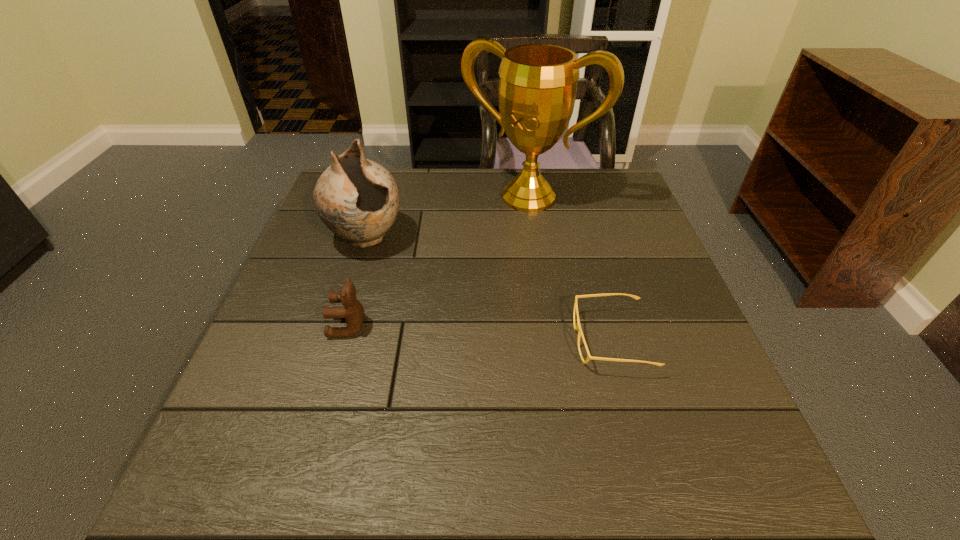
You are a GUI agent. You are given a task and a screenshot of the screen. Output one action in this format:
    pyautogui.click(x=<x>, y=<y>)
    Task: Click on the unoccupied position between the teddy bear and the shortest object
    
    Given the screenshot: What is the action you would take?
    pyautogui.click(x=480, y=333)

Identify the location of vacant space in between the second shortest object and the tallest object. (439, 261).

Locate an element on the screen. The height and width of the screenshot is (540, 960). vacant area that lies between the second shortest object and the shortest object is located at coordinates (480, 333).

In order to click on free space between the shortest object and the pottery in this screenshot , I will do `click(489, 289)`.

This screenshot has width=960, height=540. What are the coordinates of `vacant area that lies between the second tallest object and the tallest object` in the screenshot? It's located at (447, 217).

The image size is (960, 540). Identify the location of unoccupied position between the tallest object and the shortest object. (569, 268).

Where is `the third closest object to the shortest object`? The height and width of the screenshot is (540, 960). the third closest object to the shortest object is located at coordinates (353, 312).

The image size is (960, 540). Identify the location of object identified as the third closest to the pottery. (578, 327).

This screenshot has height=540, width=960. Find the location of `free space that satisfies the following two spatial constraints: 1. on the front side of the shortest object; 2. in front of the lenses of the award`. free space that satisfies the following two spatial constraints: 1. on the front side of the shortest object; 2. in front of the lenses of the award is located at coordinates (549, 340).

This screenshot has width=960, height=540. What are the coordinates of `vacant space that satisfies the following two spatial constraints: 1. on the front side of the teddy bear; 2. on the face of the second tallest object` in the screenshot? It's located at (339, 326).